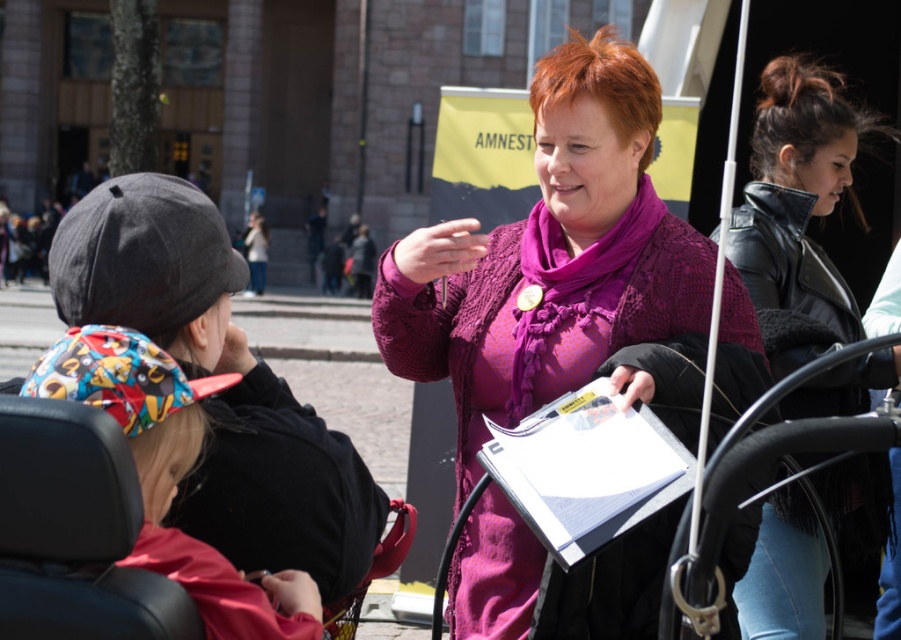
Question: Which object is closer to the camera taking this photo?

Choices:
 (A) leather jacket at right
 (B) purple lace cardigan at center
 (C) white paper clipboard at center

Answer: (C)

Question: Is purple lace cardigan at center to the left of white paper clipboard at center from the viewer's perspective?

Choices:
 (A) yes
 (B) no

Answer: (A)

Question: Estimate the real-world distances between objects in this image. Which object is closer to the white paper clipboard at center?

Choices:
 (A) purple lace cardigan at center
 (B) leather jacket at right

Answer: (A)

Question: Is purple lace cardigan at center thinner than leather jacket at right?

Choices:
 (A) yes
 (B) no

Answer: (A)

Question: Is leather jacket at right to the right of white paper clipboard at center from the viewer's perspective?

Choices:
 (A) yes
 (B) no

Answer: (A)

Question: Which object appears closest to the camera in this image?

Choices:
 (A) leather jacket at right
 (B) purple lace cardigan at center

Answer: (B)